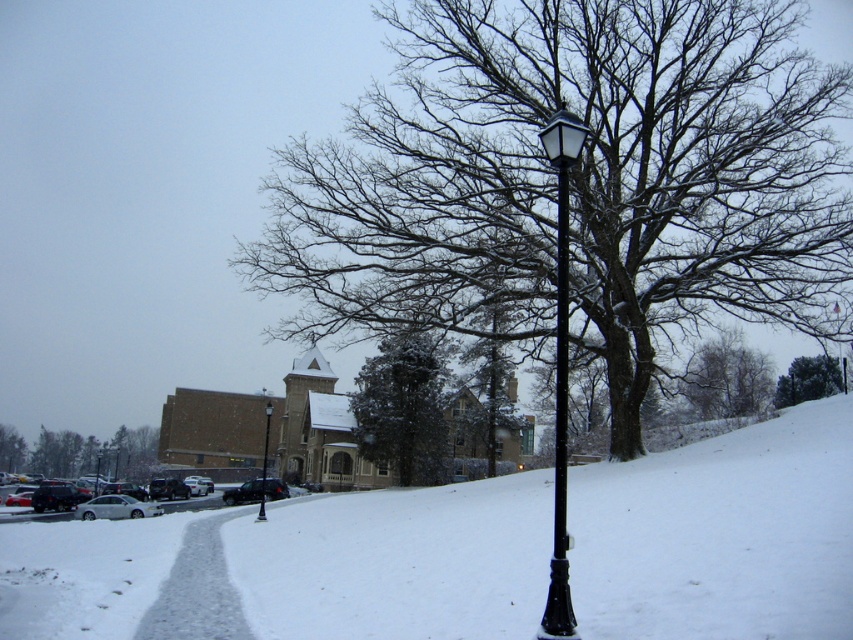
Does dark gray metallic car at center lie behind green leafy tree at lower left?

No, dark gray metallic car at center is closer to the viewer.

Who is positioned more to the right, dark gray metallic car at center or green leafy tree at lower left?

Positioned to the right is dark gray metallic car at center.

The image size is (853, 640). Find the location of `dark gray metallic car at center`. dark gray metallic car at center is located at coordinates (254, 492).

Locate an element on the screen. dark gray metallic car at center is located at coordinates coord(254,492).

Can you confirm if snowy bare branches at upper center is thinner than green leafy tree at lower left?

In fact, snowy bare branches at upper center might be wider than green leafy tree at lower left.

Is snowy bare branches at upper center bigger than green leafy tree at lower left?

Indeed, snowy bare branches at upper center has a larger size compared to green leafy tree at lower left.

At what (x,y) coordinates should I click in order to perform the action: click on snowy bare branches at upper center. Please return your answer as a coordinate pair (x, y). The width and height of the screenshot is (853, 640). Looking at the image, I should click on (727, 378).

Does green textured evergreen tree at center have a greater height compared to black metal street light at lower left?

Yes.

Is green textured evergreen tree at center closer to the viewer compared to black metal street light at lower left?

Yes, green textured evergreen tree at center is closer to the viewer.

Is point (392, 394) farther from camera compared to point (100, 458)?

No, (392, 394) is closer to viewer.

Find the location of a particular element. This screenshot has height=640, width=853. green textured evergreen tree at center is located at coordinates (404, 410).